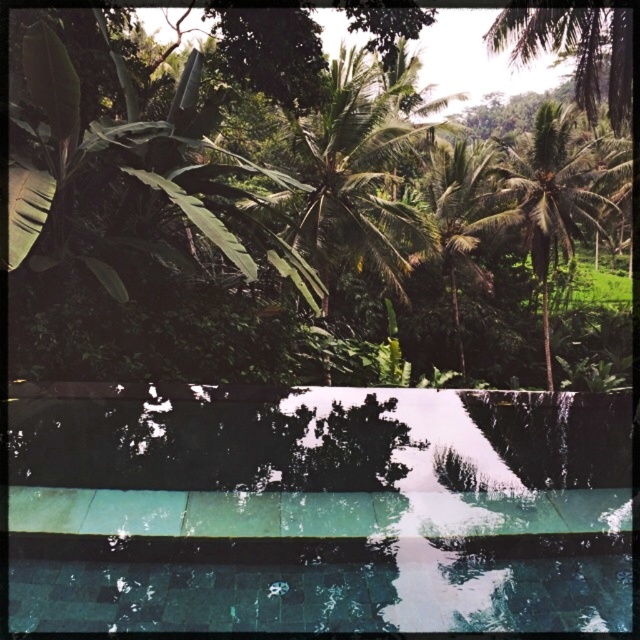
Between green leafy tree at upper center and green leafy palm tree at center, which one appears on the left side from the viewer's perspective?

green leafy tree at upper center

Where is `green leafy tree at upper center`? green leafy tree at upper center is located at coordinates (134, 163).

Find the location of a particular element. Image resolution: width=640 pixels, height=640 pixels. green leafy tree at upper center is located at coordinates (134, 163).

Where is `green leafy tree at upper center`? green leafy tree at upper center is located at coordinates (134, 163).

Is green leafy palm tree at upper right below green leafy palm tree at center?

No.

Is green leafy palm tree at upper right shorter than green leafy palm tree at center?

Incorrect, green leafy palm tree at upper right's height does not fall short of green leafy palm tree at center's.

Does point (563, 248) come behind point (472, 163)?

That is False.

The height and width of the screenshot is (640, 640). I want to click on green leafy palm tree at upper right, so click(552, 195).

Does point (378, 502) come closer to viewer compared to point (445, 195)?

Yes.

Does green tile swimming pool at center appear over green leafy palm tree at center?

Actually, green tile swimming pool at center is below green leafy palm tree at center.

Is point (148, 624) more distant than point (426, 209)?

No, it is not.

Where is `green tile swimming pool at center`? The image size is (640, 640). green tile swimming pool at center is located at coordinates (317, 509).